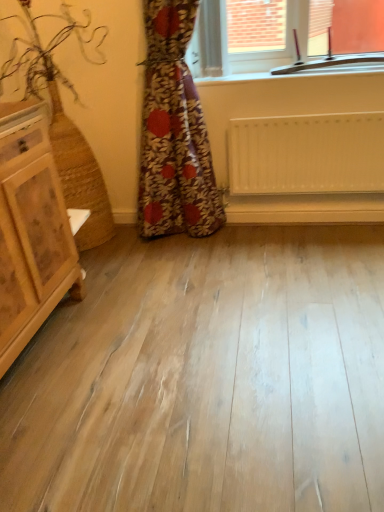
Question: Does white matte radiator at center turn towards clear glass window at upper center?

Choices:
 (A) no
 (B) yes

Answer: (A)

Question: From the image's perspective, does white matte radiator at center appear lower than clear glass window at upper center?

Choices:
 (A) yes
 (B) no

Answer: (A)

Question: Is white matte radiator at center not inside clear glass window at upper center?

Choices:
 (A) no
 (B) yes

Answer: (B)

Question: Can you confirm if white matte radiator at center is taller than clear glass window at upper center?

Choices:
 (A) no
 (B) yes

Answer: (B)

Question: Can clear glass window at upper center be found inside white matte radiator at center?

Choices:
 (A) yes
 (B) no

Answer: (B)

Question: Considering the relative sizes of white matte radiator at center and clear glass window at upper center in the image provided, is white matte radiator at center shorter than clear glass window at upper center?

Choices:
 (A) yes
 (B) no

Answer: (B)

Question: Does white matte radiator at center have a greater height compared to light brown wooden chest of drawers at left?

Choices:
 (A) yes
 (B) no

Answer: (B)

Question: Does white matte radiator at center come behind light brown wooden chest of drawers at left?

Choices:
 (A) no
 (B) yes

Answer: (B)

Question: Does white matte radiator at center have a smaller size compared to light brown wooden chest of drawers at left?

Choices:
 (A) no
 (B) yes

Answer: (B)

Question: From the image's perspective, would you say white matte radiator at center is shown under light brown wooden chest of drawers at left?

Choices:
 (A) no
 (B) yes

Answer: (A)

Question: Is white matte radiator at center looking in the opposite direction of light brown wooden chest of drawers at left?

Choices:
 (A) yes
 (B) no

Answer: (B)

Question: Can you confirm if white matte radiator at center is wider than light brown wooden chest of drawers at left?

Choices:
 (A) yes
 (B) no

Answer: (B)

Question: Is clear glass window at upper center far away from white matte radiator at center?

Choices:
 (A) no
 (B) yes

Answer: (A)